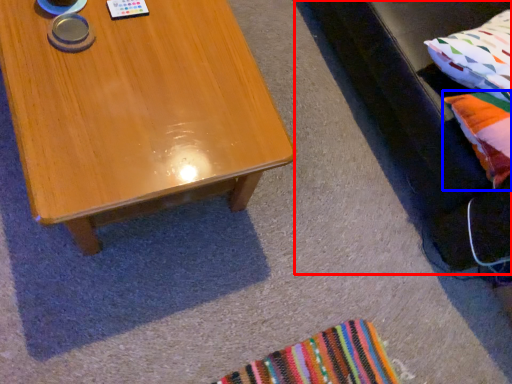
Question: Which of the following is the farthest to the observer, couch (highlighted by a red box) or pillow (highlighted by a blue box)?

Choices:
 (A) couch
 (B) pillow

Answer: (B)